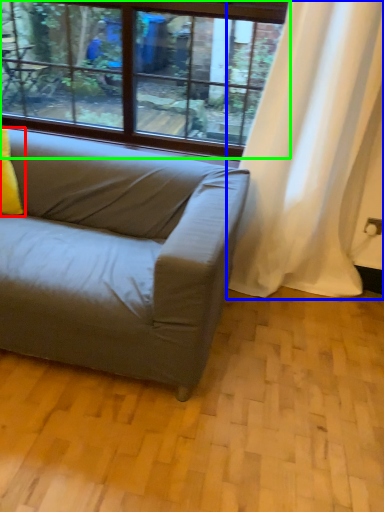
Question: Considering the real-world distances, which object is closest to pillow (highlighted by a red box)? curtain (highlighted by a blue box) or window (highlighted by a green box).

Choices:
 (A) curtain
 (B) window

Answer: (B)